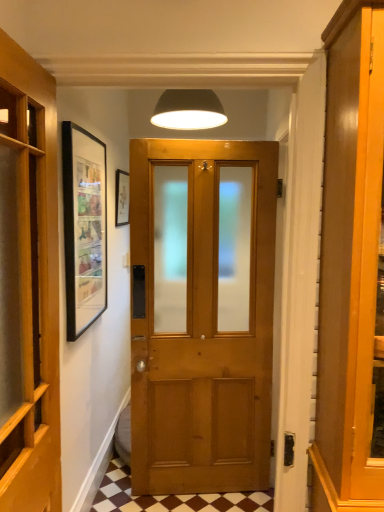
Question: Is wooden door at left closer to the viewer compared to matte black picture frame at upper left?

Choices:
 (A) yes
 (B) no

Answer: (A)

Question: Can you confirm if wooden door at left is taller than matte black picture frame at upper left?

Choices:
 (A) yes
 (B) no

Answer: (A)

Question: Considering the relative positions of wooden door at left and matte black picture frame at upper left in the image provided, is wooden door at left to the left of matte black picture frame at upper left from the viewer's perspective?

Choices:
 (A) yes
 (B) no

Answer: (A)

Question: Can you confirm if wooden door at left is wider than matte black picture frame at upper left?

Choices:
 (A) yes
 (B) no

Answer: (A)

Question: From the image's perspective, is wooden door at left on top of matte black picture frame at upper left?

Choices:
 (A) yes
 (B) no

Answer: (B)

Question: Would you say wooden door at left is a long distance from matte black picture frame at upper left?

Choices:
 (A) no
 (B) yes

Answer: (B)

Question: Considering the relative sizes of matte black picture frame at upper left and brown checkered tile at center in the image provided, is matte black picture frame at upper left taller than brown checkered tile at center?

Choices:
 (A) yes
 (B) no

Answer: (A)

Question: Is matte black picture frame at upper left bigger than brown checkered tile at center?

Choices:
 (A) no
 (B) yes

Answer: (A)

Question: Can you confirm if matte black picture frame at upper left is thinner than brown checkered tile at center?

Choices:
 (A) yes
 (B) no

Answer: (A)

Question: Is matte black picture frame at upper left smaller than brown checkered tile at center?

Choices:
 (A) yes
 (B) no

Answer: (A)

Question: Would you consider matte black picture frame at upper left to be distant from brown checkered tile at center?

Choices:
 (A) no
 (B) yes

Answer: (B)

Question: From a real-world perspective, is matte black picture frame at upper left over brown checkered tile at center?

Choices:
 (A) yes
 (B) no

Answer: (A)

Question: Can you confirm if brown checkered tile at center is wider than wooden door at left?

Choices:
 (A) no
 (B) yes

Answer: (B)